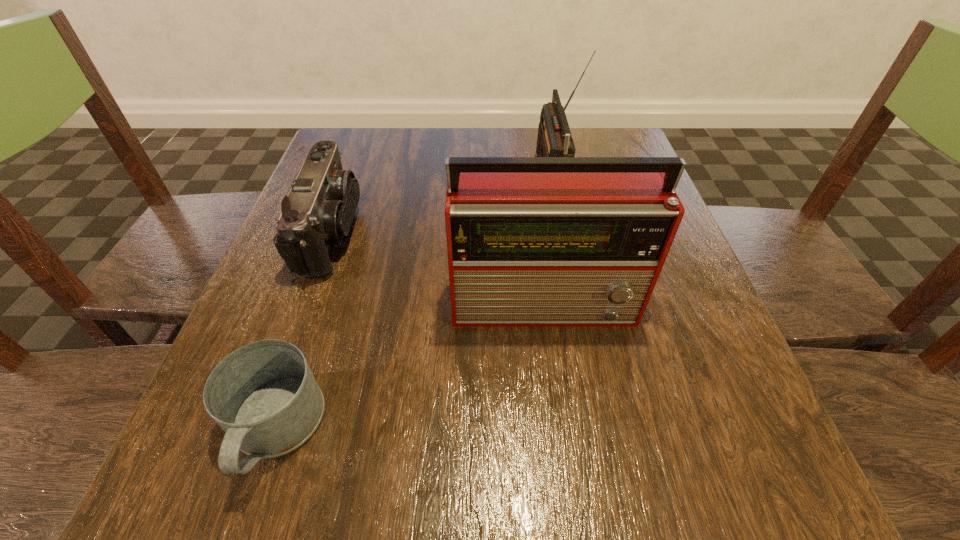
Where is `vacant space at the far left corner`? The image size is (960, 540). vacant space at the far left corner is located at coordinates (381, 134).

You are a GUI agent. You are given a task and a screenshot of the screen. Output one action in this format:
    pyautogui.click(x=<x>, y=<y>)
    Task: Click on the free location at the near left corner of the desktop
    
    Given the screenshot: What is the action you would take?
    pyautogui.click(x=188, y=468)

The image size is (960, 540). In order to click on vacant space in between the nearest object and the farther radio receiver in this screenshot , I will do point(414,302).

The height and width of the screenshot is (540, 960). I want to click on free spot between the nearer radio receiver and the shortest object, so click(412, 367).

This screenshot has width=960, height=540. In order to click on free area in between the camcorder and the farther radio receiver in this screenshot , I will do `click(442, 202)`.

The height and width of the screenshot is (540, 960). What are the coordinates of `free space between the third tallest object and the nearer radio receiver` in the screenshot? It's located at click(440, 268).

Locate an element on the screen. The image size is (960, 540). free spot between the nearer radio receiver and the nearest object is located at coordinates (x=412, y=367).

This screenshot has height=540, width=960. Identify the location of free space between the camcorder and the farther radio receiver. (442, 202).

Where is `vacant space that's between the farther radio receiver and the second shortest object`? This screenshot has width=960, height=540. vacant space that's between the farther radio receiver and the second shortest object is located at coordinates (442, 202).

Locate an element on the screen. This screenshot has width=960, height=540. blank region between the farther radio receiver and the shortest object is located at coordinates (414, 302).